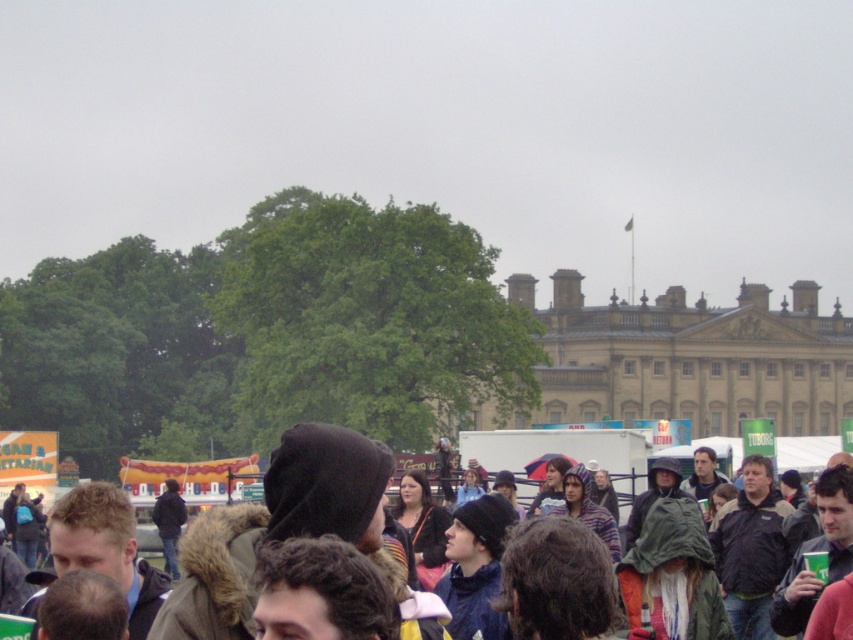
Question: Is beige stone building at center in front of dark brown hood at center?

Choices:
 (A) yes
 (B) no

Answer: (B)

Question: Can you confirm if beige stone building at center is thinner than dark brown hood at center?

Choices:
 (A) yes
 (B) no

Answer: (B)

Question: Is beige stone building at center in front of dark brown hood at center?

Choices:
 (A) yes
 (B) no

Answer: (B)

Question: Among these objects, which one is nearest to the camera?

Choices:
 (A) dark brown hood at center
 (B) beige stone building at center

Answer: (A)

Question: Which point is farther to the camera?

Choices:
 (A) beige stone building at center
 (B) dark brown hood at center

Answer: (A)